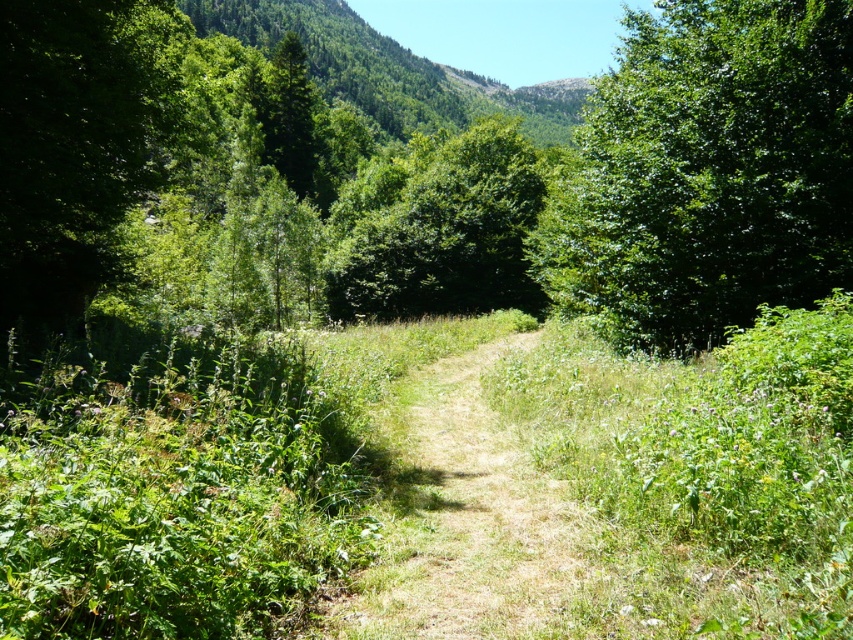
You are planning to take a photo of the green leafy tree at center and the green matte tree at upper center from the path. Which tree should you position closer to the camera to ensure both are in the frame without moving the camera?

You should position the green leafy tree at center closer to the camera because it might be wider than the green matte tree at upper center, allowing both to fit within the frame.

You are standing at the starting point of the winding dirt path in the serene landscape. There are two points marked on the path ahead of you at coordinates point (576, 256) and point (428, 234). Which point is closer to your current position?

A: Point (576, 256) is closer to the viewer than point (428, 234), so the point closer to your current position is point (576, 256).

You are a hiker who wants to take a photo of both the green leafy tree at center and the green matte tree at upper center. Which tree should you move closer to in order to capture both in the same frame?

You should move closer to the green leafy tree at center because it is closer to the viewer than the green matte tree at upper center, allowing both to be in the same frame when positioned appropriately.